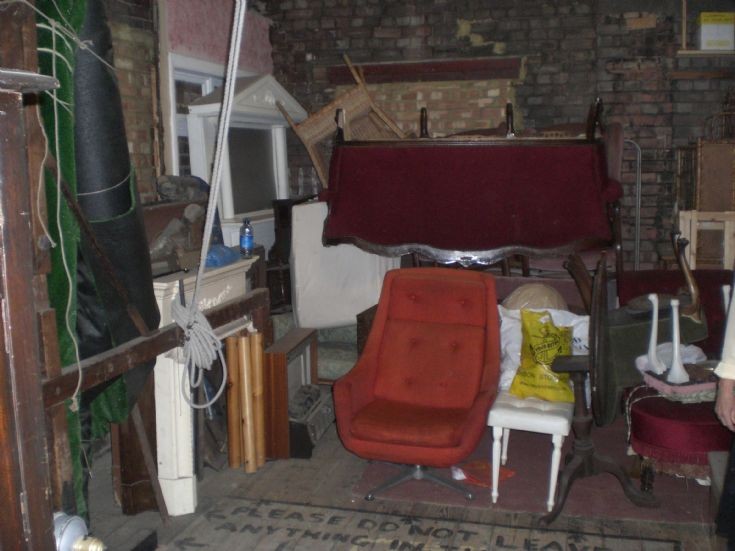
I want to click on front legs on white chair, so click(495, 464), click(552, 475).